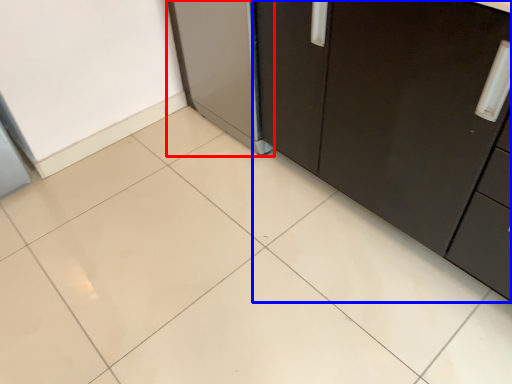
Question: Which of the following is the farthest to the observer, appliance (highlighted by a red box) or cabinetry (highlighted by a blue box)?

Choices:
 (A) appliance
 (B) cabinetry

Answer: (A)